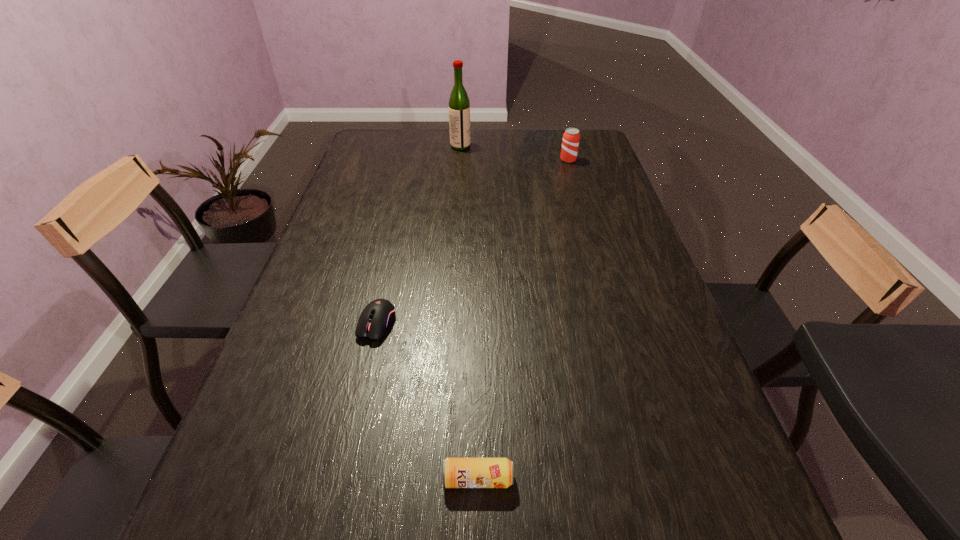
The image size is (960, 540). What are the coordinates of `free location that satisfies the following two spatial constraints: 1. on the back side of the taller beer can; 2. on the left side of the computer mouse` in the screenshot? It's located at (414, 160).

In order to click on free location that satisfies the following two spatial constraints: 1. on the label of the nearest object; 2. on the left side of the farthest object in this screenshot , I will do `click(438, 478)`.

In order to click on vacant area in the image that satisfies the following two spatial constraints: 1. on the label of the shorter beer can; 2. on the left side of the liquor in this screenshot , I will do `click(438, 478)`.